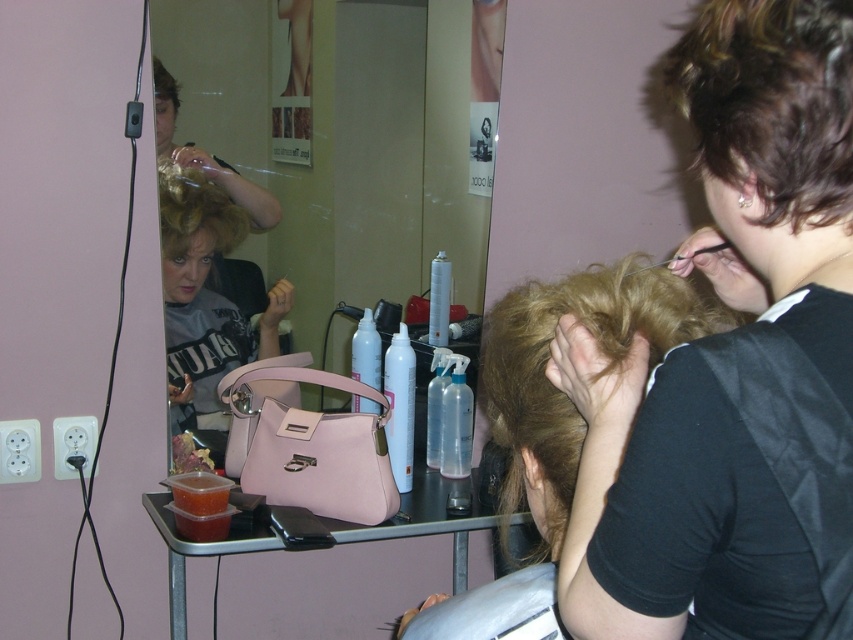
From the picture: You are a customer in the salon and want to place your matte pink handbag at center on the counter next to the blonde synthetic hair at upper left. Considering their sizes, will the handbag fit without overlapping the hair?

The matte pink handbag at center is wider than the blonde synthetic hair at upper left, so placing it next to the hair may cause overlapping since the handbag is wider.

You are a customer in the hair salon and want to know where your hair is being styled. The stylist is holding a section of your hair. According to the image, where exactly is your dark brown hair at upper right located?

The dark brown hair at upper right is located at point (733, 364).